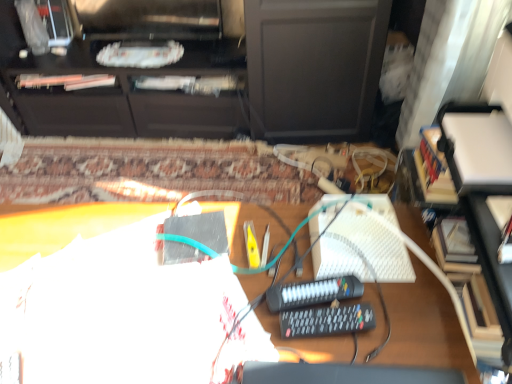
In order to click on vacant area that lies between white textured keyboard at center-right and black plastic remote control at center, arranged as the 1th equipment when viewed from the back in this screenshot , I will do `click(320, 266)`.